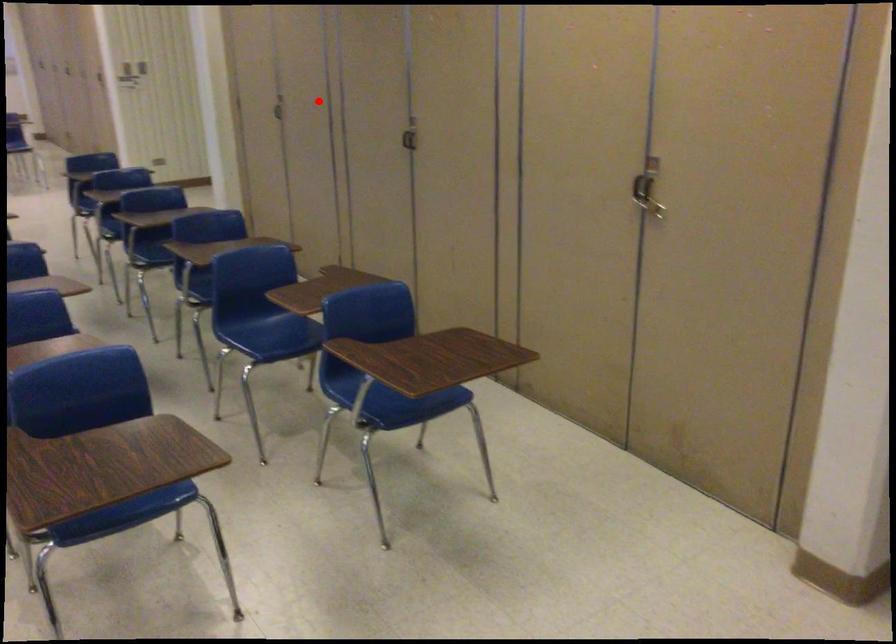
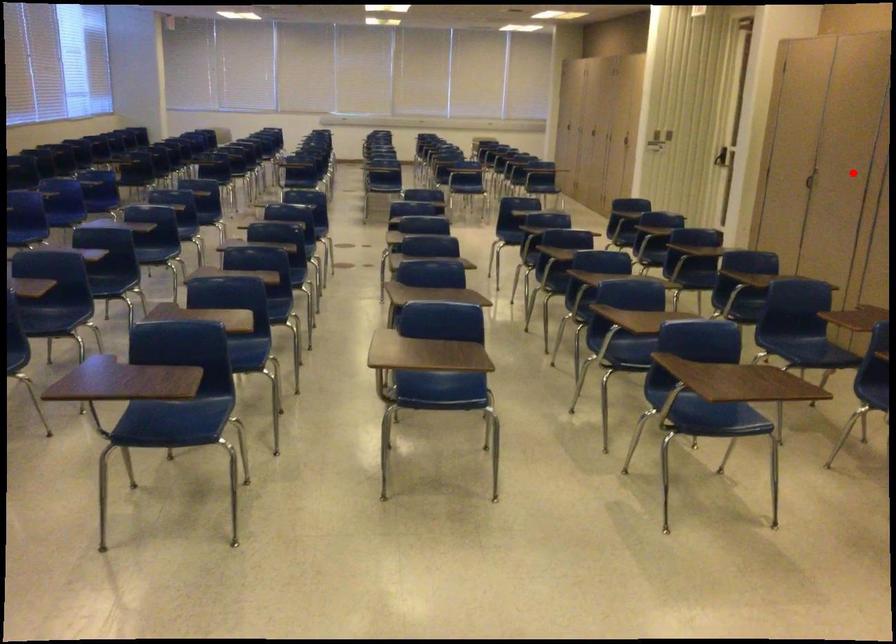
In the scene shown: I am providing you with two images of the same scene from different viewpoints. A red point is marked on the first image and another point is marked on the second image. Is the marked point in image1 the same physical position as the marked point in image2?

Yes